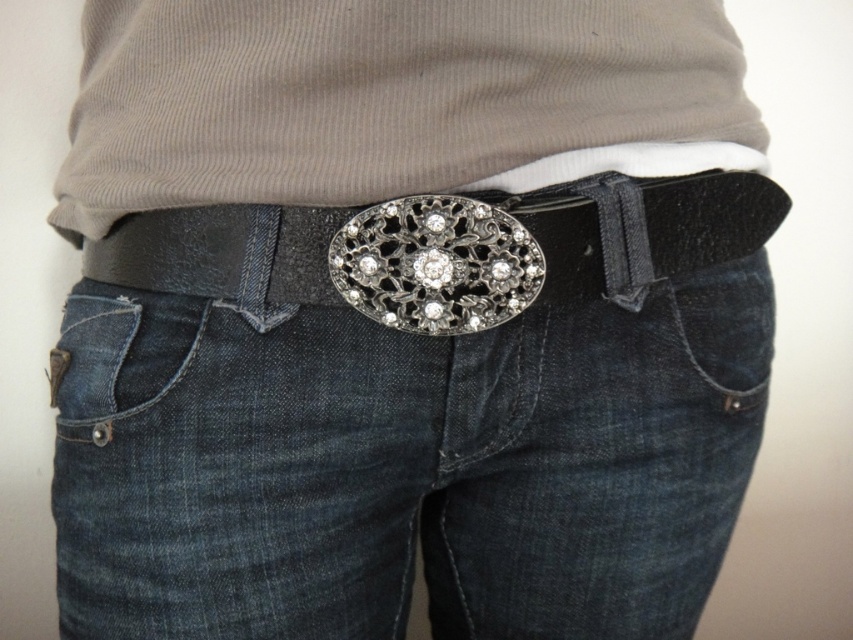
You are a fashion designer looking to create a belt accessory. You observe the metallic silver buckle at center and the denim at lower left in the image. Which object should you focus on if you want to incorporate a larger element into your design?

The metallic silver buckle at center has a larger size compared to the denim at lower left, so you should focus on the metallic silver buckle at center for incorporating a larger element into your design.

You are trying to fasten the belt on your jeans. The metallic silver buckle at center and the denim at lower left are in your view. Which one is closer to you?

The metallic silver buckle at center is closer to you because it is in front of the denim at lower left.